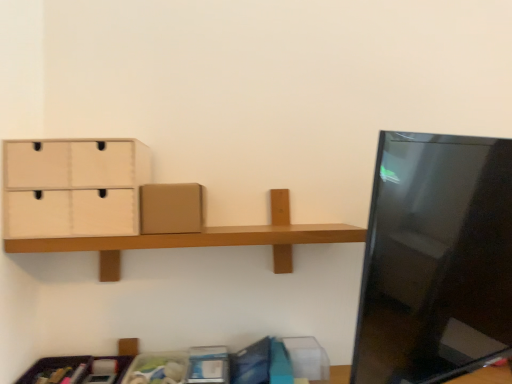
In order to face brown cardboard box at center, should I rotate leftwards or rightwards?

Turn left by 10.599 degrees to look at brown cardboard box at center.

In order to click on brown cardboard box at center in this screenshot , I will do `click(170, 208)`.

This screenshot has height=384, width=512. Describe the element at coordinates (170, 208) in the screenshot. I see `brown cardboard box at center` at that location.

What is the approximate height of brown cardboard box at center?

It is 5.56 inches.

What is the approximate width of beige cardboard drawer at upper left?

beige cardboard drawer at upper left is 8.15 inches wide.

This screenshot has height=384, width=512. Find the location of `beige cardboard drawer at upper left`. beige cardboard drawer at upper left is located at coordinates (73, 187).

Describe the element at coordinates (73, 187) in the screenshot. This screenshot has height=384, width=512. I see `beige cardboard drawer at upper left` at that location.

You are a GUI agent. You are given a task and a screenshot of the screen. Output one action in this format:
    pyautogui.click(x=<x>, y=<y>)
    Task: Click on the brown cardboard box at center
    
    Given the screenshot: What is the action you would take?
    pyautogui.click(x=170, y=208)

Considering the relative positions of beige cardboard drawer at upper left and brown cardboard box at center in the image provided, is beige cardboard drawer at upper left to the right of brown cardboard box at center from the viewer's perspective?

No.

Which object is further away from the camera taking this photo, beige cardboard drawer at upper left or brown cardboard box at center?

brown cardboard box at center is further from the camera.

Is point (8, 187) less distant than point (200, 210)?

Yes, point (8, 187) is closer to viewer.

From the image's perspective, which is below, beige cardboard drawer at upper left or brown cardboard box at center?

brown cardboard box at center.

From a real-world perspective, which object rests below the other?

In real-world perspective, brown cardboard box at center is lower.

Between beige cardboard drawer at upper left and brown cardboard box at center, which one has larger width?

brown cardboard box at center.

Considering the sizes of objects beige cardboard drawer at upper left and brown cardboard box at center in the image provided, who is shorter, beige cardboard drawer at upper left or brown cardboard box at center?

brown cardboard box at center is shorter.

Considering the sizes of beige cardboard drawer at upper left and brown cardboard box at center in the image, is beige cardboard drawer at upper left bigger or smaller than brown cardboard box at center?

beige cardboard drawer at upper left is bigger than brown cardboard box at center.

Would you say beige cardboard drawer at upper left contains brown cardboard box at center?

No, brown cardboard box at center is not a part of beige cardboard drawer at upper left.

Is beige cardboard drawer at upper left far from brown cardboard box at center?

beige cardboard drawer at upper left is actually quite close to brown cardboard box at center.

Does beige cardboard drawer at upper left turn towards brown cardboard box at center?

No, beige cardboard drawer at upper left is not turned towards brown cardboard box at center.

Identify the location of cardboard box below the beige cardboard drawer at upper left (from the image's perspective). (170, 208).

In the image, is brown cardboard box at center on the left side or the right side of beige cardboard drawer at upper left?

Based on their positions, brown cardboard box at center is located to the right of beige cardboard drawer at upper left.

Which object is further away from the camera taking this photo, brown cardboard box at center or beige cardboard drawer at upper left?

brown cardboard box at center.

Is point (147, 210) positioned in front of point (37, 200)?

No, (147, 210) is behind (37, 200).

From the image's perspective, which object appears higher, brown cardboard box at center or beige cardboard drawer at upper left?

beige cardboard drawer at upper left is shown above in the image.

From a real-world perspective, is brown cardboard box at center positioned above or below beige cardboard drawer at upper left?

brown cardboard box at center is situated lower than beige cardboard drawer at upper left in the real world.

Which object is thinner, brown cardboard box at center or beige cardboard drawer at upper left?

Thinner between the two is beige cardboard drawer at upper left.

Considering the sizes of objects brown cardboard box at center and beige cardboard drawer at upper left in the image provided, who is shorter, brown cardboard box at center or beige cardboard drawer at upper left?

Standing shorter between the two is brown cardboard box at center.

From the picture: Who is smaller, brown cardboard box at center or beige cardboard drawer at upper left?

With smaller size is brown cardboard box at center.

Do you think brown cardboard box at center is within beige cardboard drawer at upper left, or outside of it?

brown cardboard box at center lies outside beige cardboard drawer at upper left.

Does brown cardboard box at center touch beige cardboard drawer at upper left?

No, brown cardboard box at center is not touching beige cardboard drawer at upper left.

Is brown cardboard box at center aimed at beige cardboard drawer at upper left?

No, brown cardboard box at center is not turned towards beige cardboard drawer at upper left.

What's the angular difference between brown cardboard box at center and beige cardboard drawer at upper left's facing directions?

4.04e-05 degrees separate the facing orientations of brown cardboard box at center and beige cardboard drawer at upper left.

Measure the distance from brown cardboard box at center to beige cardboard drawer at upper left.

brown cardboard box at center and beige cardboard drawer at upper left are 5.51 inches apart.

Where is `cardboard box lying on the right of beige cardboard drawer at upper left`? cardboard box lying on the right of beige cardboard drawer at upper left is located at coordinates (170, 208).

Locate an element on the screen. drawer above the brown cardboard box at center (from the image's perspective) is located at coordinates (73, 187).

Locate an element on the screen. The height and width of the screenshot is (384, 512). cardboard box below the beige cardboard drawer at upper left (from the image's perspective) is located at coordinates (170, 208).